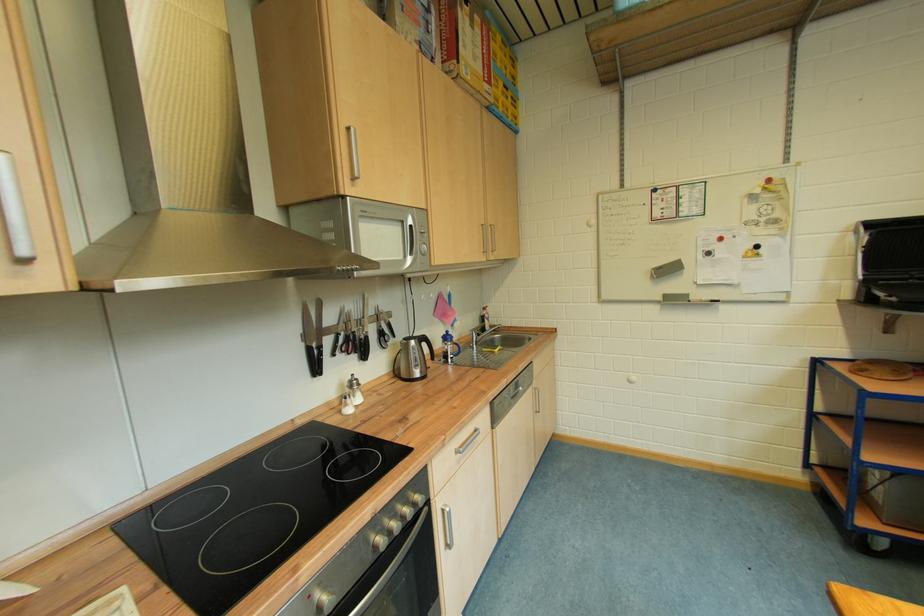
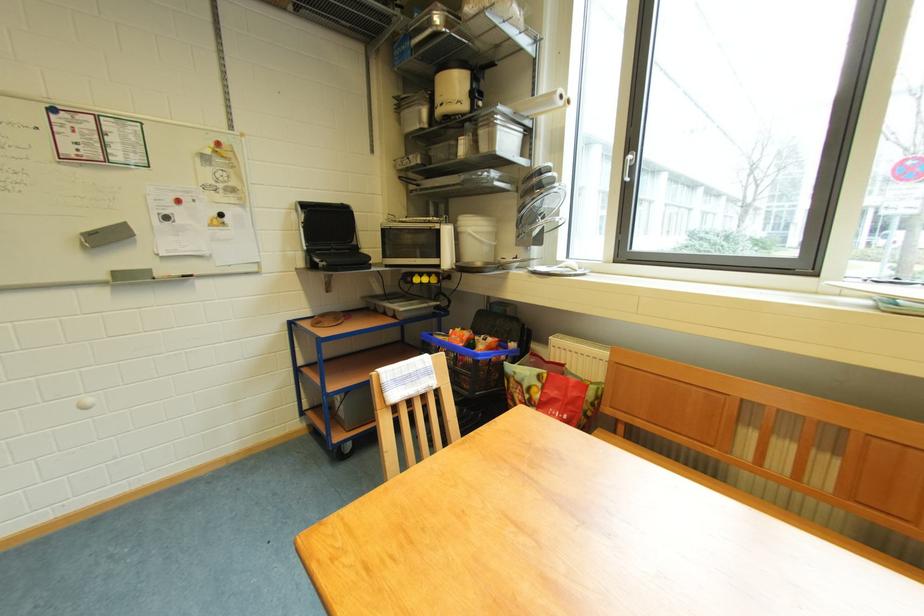
Where in the second image is the point corresponding to point (662, 278) from the first image?

(95, 248)